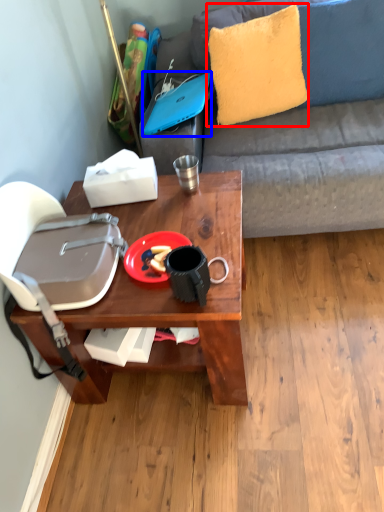
Question: Which object appears farthest to the camera in this image, pillow (highlighted by a red box) or laptop (highlighted by a blue box)?

Choices:
 (A) pillow
 (B) laptop

Answer: (A)